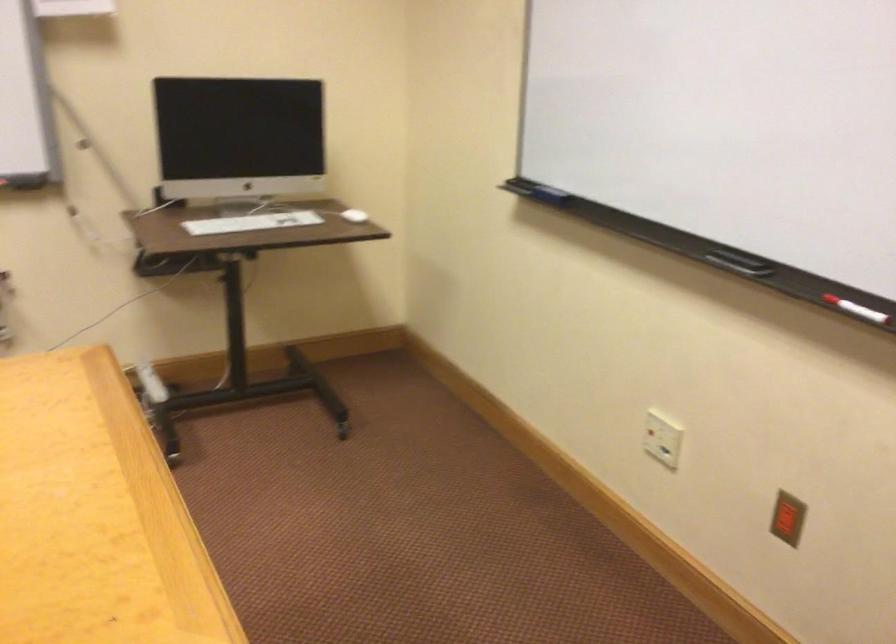
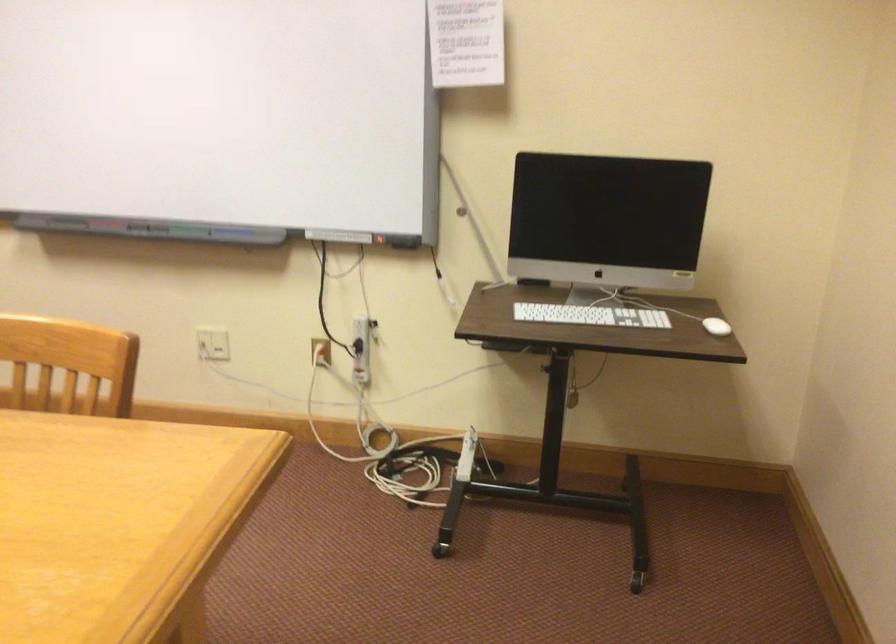
Question: The camera is either moving clockwise (left) or counter-clockwise (right) around the object. The first image is from the beginning of the video and the second image is from the end. Is the camera moving left or right when shooting the video?

Choices:
 (A) Left
 (B) Right

Answer: (B)